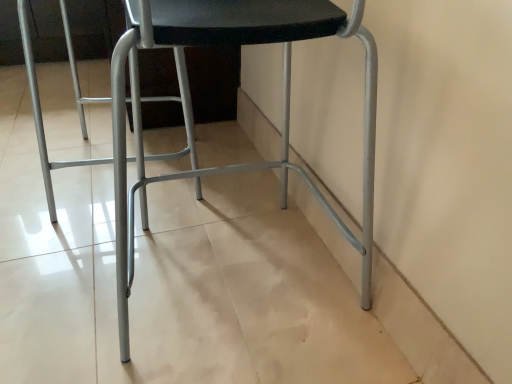
Identify the location of vacant area that lies to the right of metallic silver swivel chair at center. (239, 175).